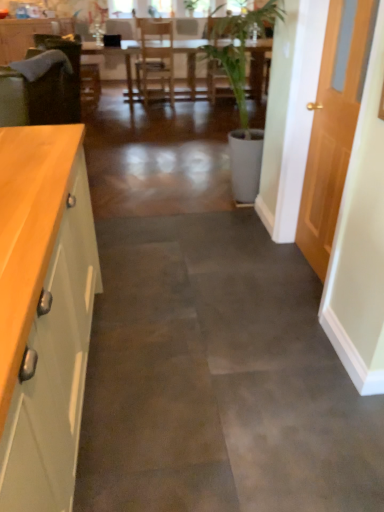
Question: Can you confirm if green matte cabinet at left, which is the first cabinetry in bottom-to-top order, is wider than wooden table at center?

Choices:
 (A) yes
 (B) no

Answer: (B)

Question: From a real-world perspective, does green matte cabinet at left, the 1th cabinetry in the right-to-left sequence, sit lower than wooden table at center?

Choices:
 (A) yes
 (B) no

Answer: (B)

Question: Is the position of green matte cabinet at left, which is the first cabinetry in bottom-to-top order, more distant than that of wooden table at center?

Choices:
 (A) yes
 (B) no

Answer: (B)

Question: From the image's perspective, is green matte cabinet at left, acting as the 2th cabinetry starting from the top, on wooden table at center?

Choices:
 (A) yes
 (B) no

Answer: (B)

Question: Considering the relative positions of green matte cabinet at left, the second cabinetry from the back, and wooden table at center in the image provided, is green matte cabinet at left, the second cabinetry from the back, to the right of wooden table at center from the viewer's perspective?

Choices:
 (A) no
 (B) yes

Answer: (A)

Question: From a real-world perspective, relative to velvet green armchair at left, is wooden door at right vertically above or below?

Choices:
 (A) below
 (B) above

Answer: (B)

Question: From the image's perspective, relative to velvet green armchair at left, is wooden door at right above or below?

Choices:
 (A) below
 (B) above

Answer: (A)

Question: Is point (352, 42) closer or farther from the camera than point (82, 73)?

Choices:
 (A) farther
 (B) closer

Answer: (B)

Question: Considering the positions of wooden door at right and velvet green armchair at left in the image, is wooden door at right bigger or smaller than velvet green armchair at left?

Choices:
 (A) small
 (B) big

Answer: (A)

Question: Is point (91, 99) closer or farther from the camera than point (9, 200)?

Choices:
 (A) farther
 (B) closer

Answer: (A)

Question: Considering the relative positions of velvet green armchair at left and green matte cabinet at left, which is the first cabinetry in bottom-to-top order, in the image provided, is velvet green armchair at left to the left or to the right of green matte cabinet at left, which is the first cabinetry in bottom-to-top order,?

Choices:
 (A) left
 (B) right

Answer: (A)

Question: Considering the positions of velvet green armchair at left and green matte cabinet at left, placed as the first cabinetry when sorted from front to back, in the image, is velvet green armchair at left taller or shorter than green matte cabinet at left, placed as the first cabinetry when sorted from front to back,?

Choices:
 (A) tall
 (B) short

Answer: (A)

Question: From a real-world perspective, is velvet green armchair at left above or below green matte cabinet at left, placed as the first cabinetry when sorted from front to back?

Choices:
 (A) below
 (B) above

Answer: (B)

Question: Choose the correct answer: Is wooden door at right inside green matte cabinet at left, the 2th cabinetry viewed from the left, or outside it?

Choices:
 (A) inside
 (B) outside

Answer: (B)

Question: Considering their positions, is wooden door at right located in front of or behind green matte cabinet at left, the 2th cabinetry viewed from the left?

Choices:
 (A) front
 (B) behind

Answer: (B)